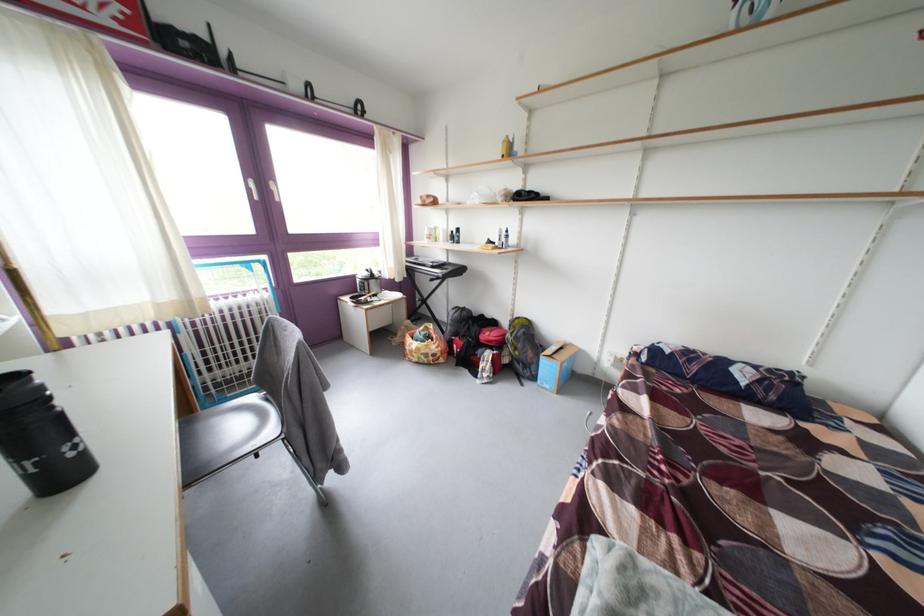
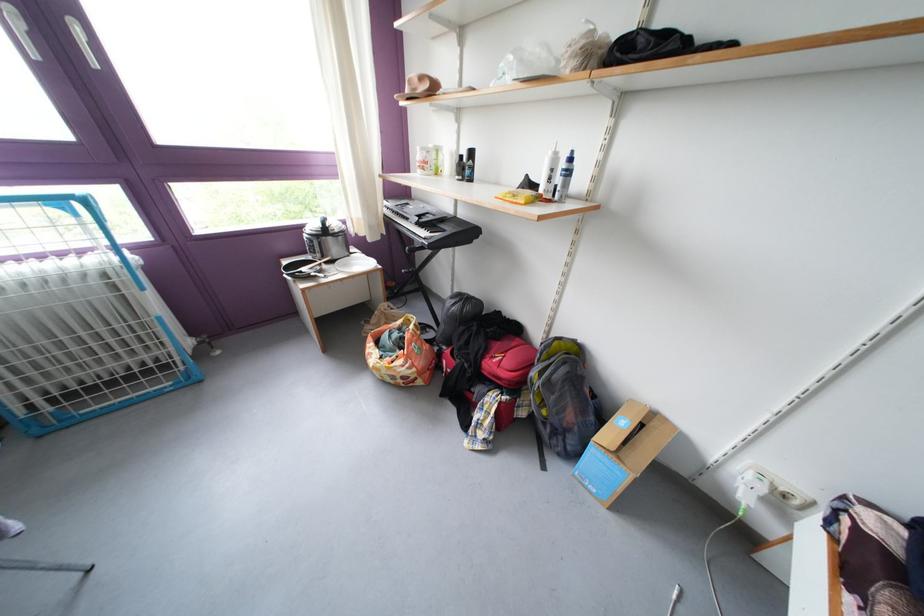
Find the pixel in the second image that matches [463,237] in the first image.

(471, 161)